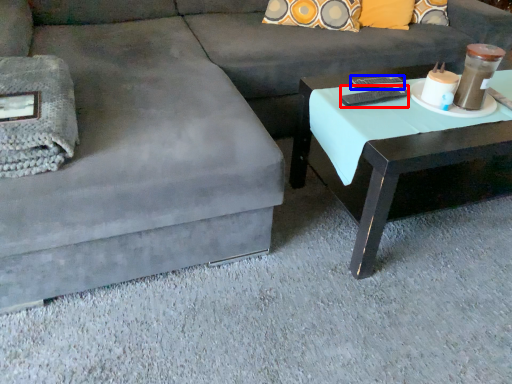
Question: Among these objects, which one is nearest to the camera, remote (highlighted by a red box) or remote (highlighted by a blue box)?

Choices:
 (A) remote
 (B) remote

Answer: (A)